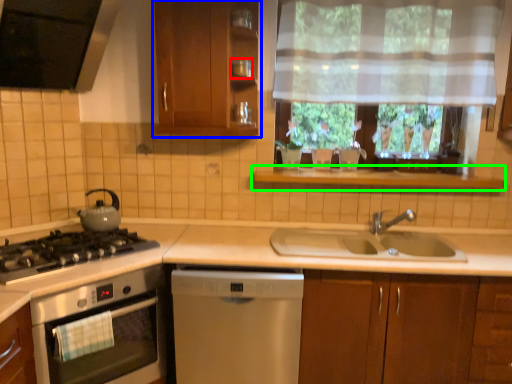
Question: Which object is the closest to the appliance (highlighted by a red box)? Choose among these: cabinetry (highlighted by a blue box) or window sill (highlighted by a green box).

Choices:
 (A) cabinetry
 (B) window sill

Answer: (A)